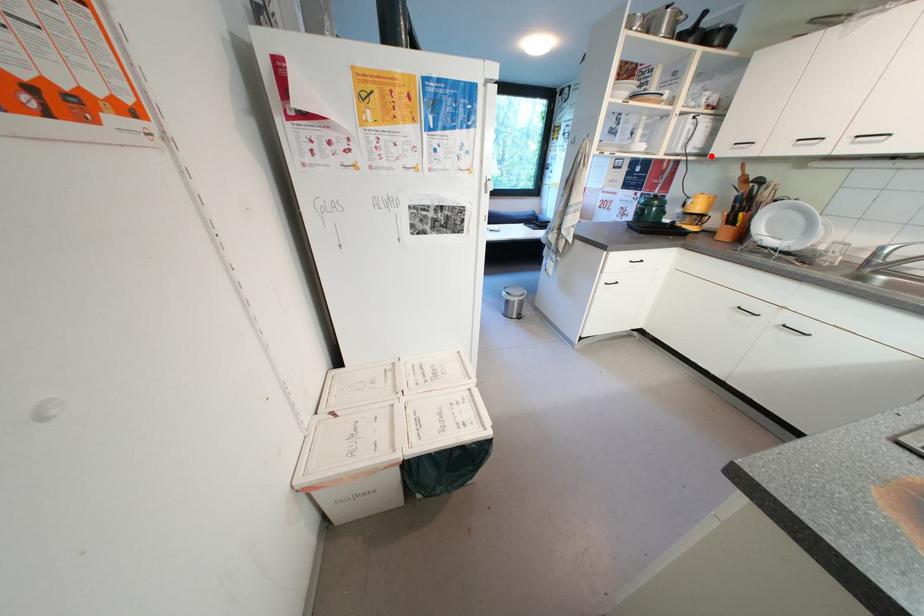
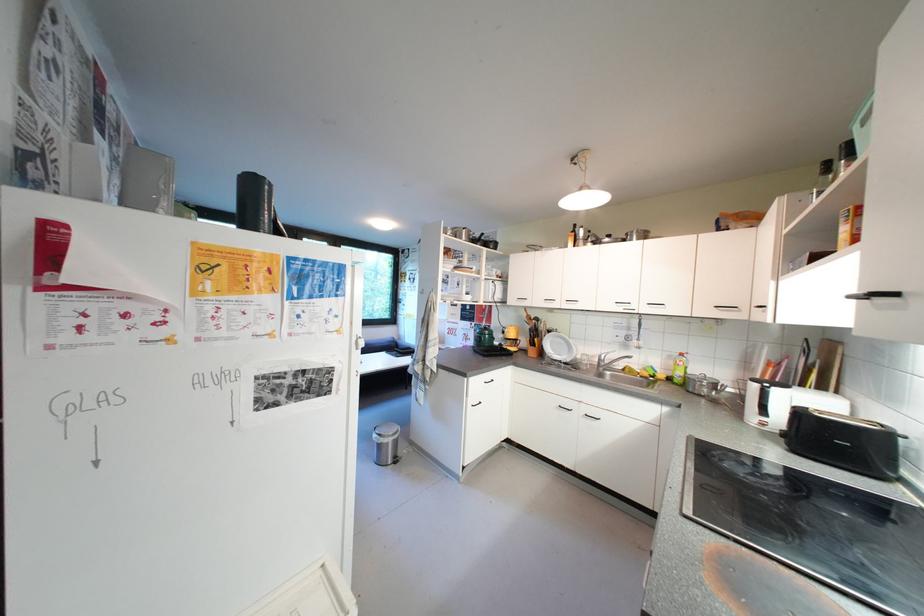
The point at the highlighted location is marked in the first image. Where is the corresponding point in the second image?

(512, 304)